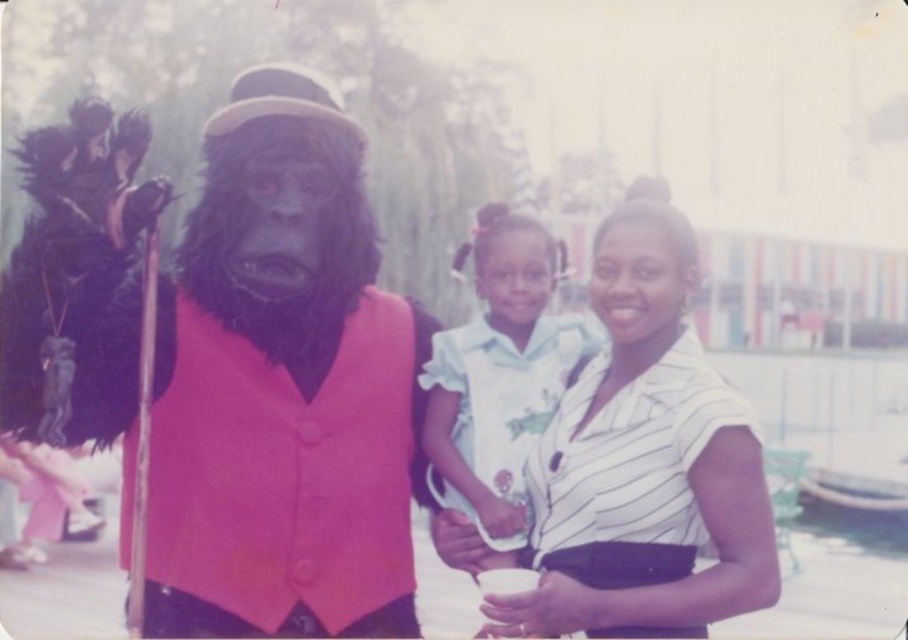
You are a photographer trying to capture the perfect shot of the two central figures. You notice the white striped shirt at center and the white cotton dress at center. Which one is positioned to the right of the other?

The white striped shirt at center is to the right of the white cotton dress at center.

You are a photographer trying to focus on the velvet pink vest at center. What are the exact coordinates where you should aim your camera to capture it perfectly?

The velvet pink vest at center is located at the 2D coordinates point (284, 388), so you should aim your camera precisely at those coordinates to capture it perfectly.

You are a photographer trying to capture a clear photo of the velvet pink vest at center and the white cotton dress at center. Which object should you focus on first if you want to ensure both are in focus without adjusting the camera settings?

The velvet pink vest at center is wider than the white cotton dress at center, so focusing on the velvet pink vest at center first would help ensure both are in focus since it is larger and requires more attention.